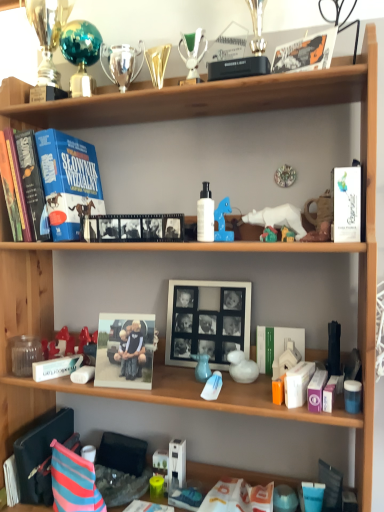
Question: Is white glossy book at upper right, which is the 4th magazine in left-to-right order, aimed at black plastic magazine at lower left, the 1th magazine when ordered from left to right?

Choices:
 (A) no
 (B) yes

Answer: (A)

Question: Is white glossy book at upper right, which is the 4th magazine in left-to-right order, positioned with its back to black plastic magazine at lower left, the 1th magazine when ordered from left to right?

Choices:
 (A) no
 (B) yes

Answer: (A)

Question: Can we say white glossy book at upper right, the first magazine viewed from the front, lies outside black plastic magazine at lower left, the 1th magazine when ordered from left to right?

Choices:
 (A) no
 (B) yes

Answer: (B)

Question: Does white glossy book at upper right, the 4th magazine in the back-to-front sequence, have a lesser height compared to black plastic magazine at lower left, which is counted as the 4th magazine, starting from the right?

Choices:
 (A) no
 (B) yes

Answer: (B)

Question: Is white glossy book at upper right, the 4th magazine in the back-to-front sequence, taller than black plastic magazine at lower left, which is counted as the 4th magazine, starting from the right?

Choices:
 (A) yes
 (B) no

Answer: (B)

Question: From a real-world perspective, is metallic gold trophy at upper center, the fourth toy from the right, physically located above or below matte plastic photo frame at center, the second picture frame positioned from the right?

Choices:
 (A) below
 (B) above

Answer: (B)

Question: Considering the positions of metallic gold trophy at upper center, which is counted as the third toy, starting from the top, and matte plastic photo frame at center, the 2th picture frame in the back-to-front sequence, in the image, is metallic gold trophy at upper center, which is counted as the third toy, starting from the top, wider or thinner than matte plastic photo frame at center, the 2th picture frame in the back-to-front sequence,?

Choices:
 (A) thin
 (B) wide

Answer: (A)

Question: Considering the positions of metallic gold trophy at upper center, the 4th toy ordered from the bottom, and matte plastic photo frame at center, which ranks as the first picture frame in front-to-back order, in the image, is metallic gold trophy at upper center, the 4th toy ordered from the bottom, taller or shorter than matte plastic photo frame at center, which ranks as the first picture frame in front-to-back order,?

Choices:
 (A) short
 (B) tall

Answer: (A)

Question: Based on their positions, is metallic gold trophy at upper center, the fourth toy from the right, located to the left or right of matte plastic photo frame at center, the 2th picture frame in the back-to-front sequence?

Choices:
 (A) right
 (B) left

Answer: (A)

Question: Is black plastic magazine at lower left, the second magazine positioned from the back, bigger or smaller than shiny silver trophy at upper center, the fifth toy when ordered from bottom to top?

Choices:
 (A) small
 (B) big

Answer: (B)

Question: From a real-world perspective, is black plastic magazine at lower left, which ranks as the 3th magazine in front-to-back order, physically located above or below shiny silver trophy at upper center, arranged as the 2th toy when viewed from the top?

Choices:
 (A) below
 (B) above

Answer: (A)

Question: Looking at their shapes, would you say black plastic magazine at lower left, the 1th magazine when ordered from left to right, is wider or thinner than shiny silver trophy at upper center, the fifth toy when ordered from bottom to top?

Choices:
 (A) thin
 (B) wide

Answer: (B)

Question: Does point (43, 440) appear closer or farther from the camera than point (125, 53)?

Choices:
 (A) farther
 (B) closer

Answer: (B)

Question: Relative to black matte film strip at upper center, which appears as the third magazine when viewed from the back, is translucent plastic bag at center, acting as the 2th toy starting from the right, in front or behind?

Choices:
 (A) behind
 (B) front

Answer: (B)

Question: In terms of width, does translucent plastic bag at center, which is the first toy in bottom-to-top order, look wider or thinner when compared to black matte film strip at upper center, the 3th magazine in the right-to-left sequence?

Choices:
 (A) wide
 (B) thin

Answer: (A)